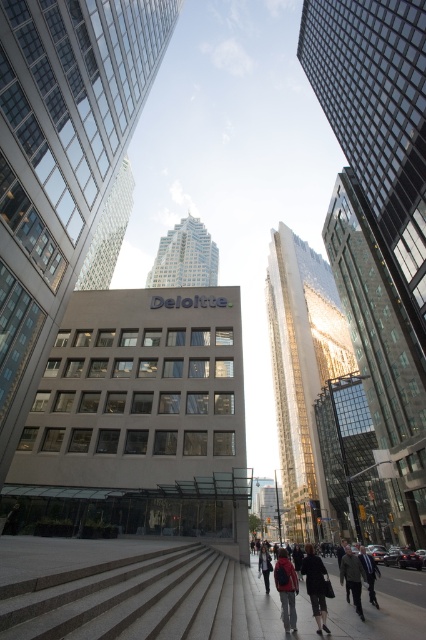
Question: Considering the real-world distances, which object is closest to the dark blue suit at center?

Choices:
 (A) red jacket at center
 (B) denim jacket at center
 (C) dark blue backpack at lower center

Answer: (C)

Question: Is dark gray sweater at center below denim jacket at center?

Choices:
 (A) no
 (B) yes

Answer: (A)

Question: Does dark blue backpack at lower center have a greater width compared to dark blue suit at center?

Choices:
 (A) no
 (B) yes

Answer: (B)

Question: Is dark gray sweater at center wider than dark blue suit at center?

Choices:
 (A) no
 (B) yes

Answer: (A)

Question: Which of the following is the closest to the observer?

Choices:
 (A) (307, 557)
 (B) (336, 588)
 (C) (340, 576)
 (D) (271, 616)

Answer: (D)

Question: Among these objects, which one is farthest from the camera?

Choices:
 (A) gray concrete pavement at center
 (B) dark gray sweater at center
 (C) denim jacket at center

Answer: (C)